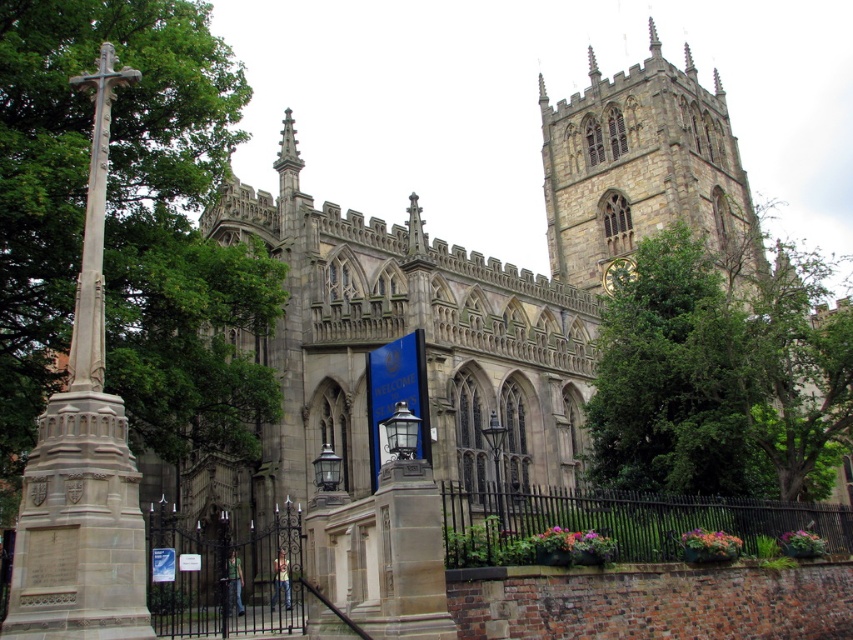
Question: Can you confirm if stone church at center is wider than stone clock tower at upper center?

Choices:
 (A) yes
 (B) no

Answer: (A)

Question: Estimate the real-world distances between objects in this image. Which object is farther from the stone clock tower at upper center?

Choices:
 (A) stone church at center
 (B) polished stone cross at left
 (C) gold metallic clock at upper right
 (D) green leafy tree at center

Answer: (B)

Question: Is green leafy tree at center below stone clock tower at upper center?

Choices:
 (A) no
 (B) yes

Answer: (B)

Question: Which of the following is the closest to the observer?

Choices:
 (A) (608, 275)
 (B) (93, 545)

Answer: (B)

Question: Can you confirm if stone church at center is bigger than polished stone cross at left?

Choices:
 (A) yes
 (B) no

Answer: (A)

Question: Which object is positioned closest to the gold metallic clock at upper right?

Choices:
 (A) polished stone cross at left
 (B) stone clock tower at upper center

Answer: (B)